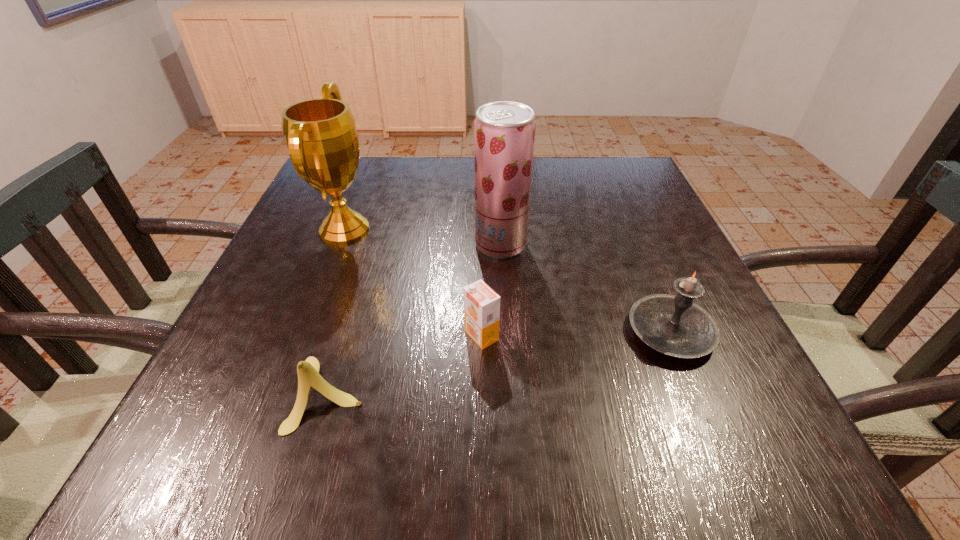
Where is `free point at the left edge`? The image size is (960, 540). free point at the left edge is located at coordinates (325, 213).

This screenshot has width=960, height=540. Find the location of `vacant space at the right edge of the desktop`. vacant space at the right edge of the desktop is located at coordinates (625, 219).

The image size is (960, 540). In order to click on vacant space at the far left corner of the desktop in this screenshot , I will do `click(379, 160)`.

Where is `free space at the near left corner of the desktop`? free space at the near left corner of the desktop is located at coordinates (236, 447).

I want to click on vacant space at the far right corner of the desktop, so click(x=628, y=192).

Where is `free point at the near right corner`? free point at the near right corner is located at coordinates (689, 441).

This screenshot has width=960, height=540. I want to click on free space between the fruit juice and the award, so click(422, 237).

Find the location of a particular element. free space that is in between the candle and the banana is located at coordinates (499, 363).

Locate an element on the screen. free point between the award and the fruit juice is located at coordinates (422, 237).

Image resolution: width=960 pixels, height=540 pixels. I want to click on free area in between the fruit juice and the third shortest object, so click(x=586, y=288).